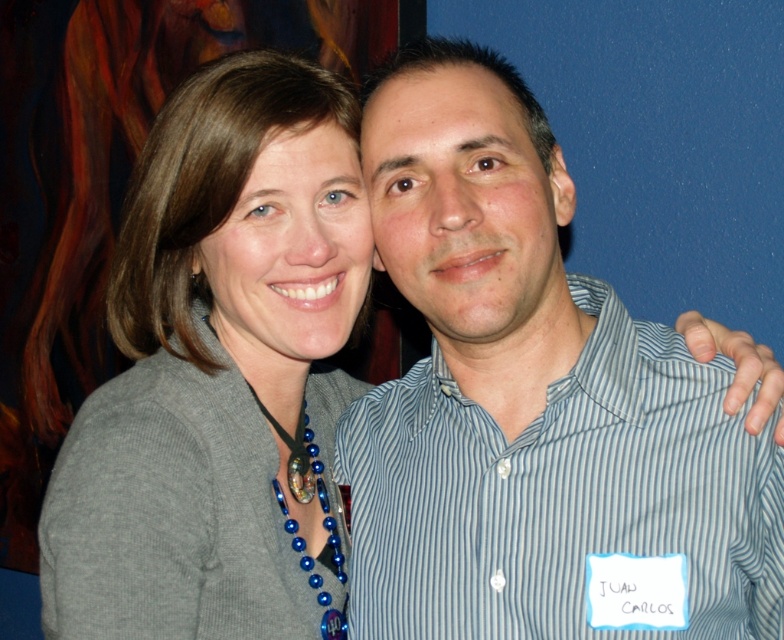
Question: Does blue striped shirt at center have a larger size compared to gray knitted sweater at upper left?

Choices:
 (A) no
 (B) yes

Answer: (A)

Question: Is blue striped shirt at center below gray knitted sweater at upper left?

Choices:
 (A) no
 (B) yes

Answer: (A)

Question: Which point is farther to the camera?

Choices:
 (A) click(64, 579)
 (B) click(601, 529)

Answer: (B)

Question: Does blue striped shirt at center have a larger size compared to gray knitted sweater at upper left?

Choices:
 (A) no
 (B) yes

Answer: (A)

Question: Among these points, which one is farthest from the camera?

Choices:
 (A) (144, 248)
 (B) (547, 605)

Answer: (A)